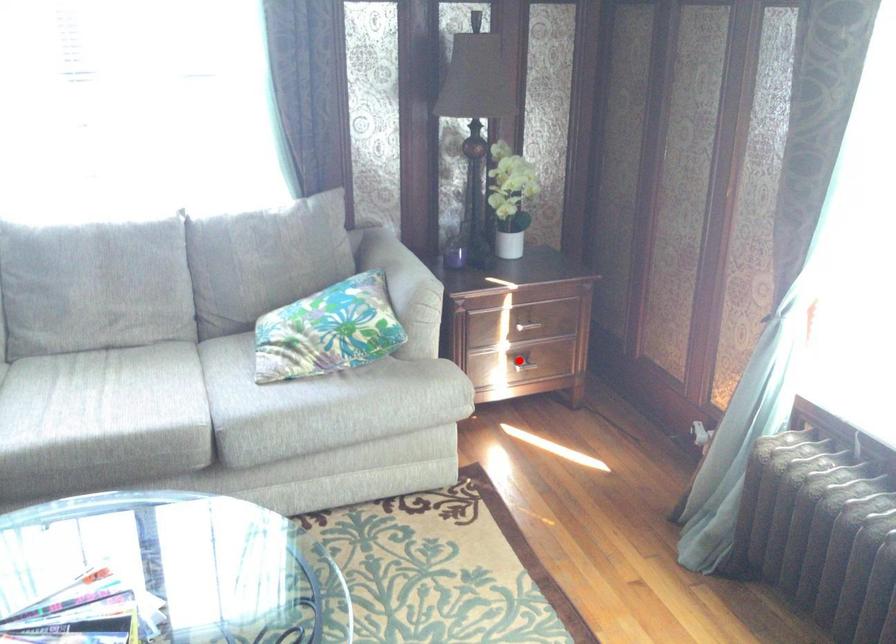
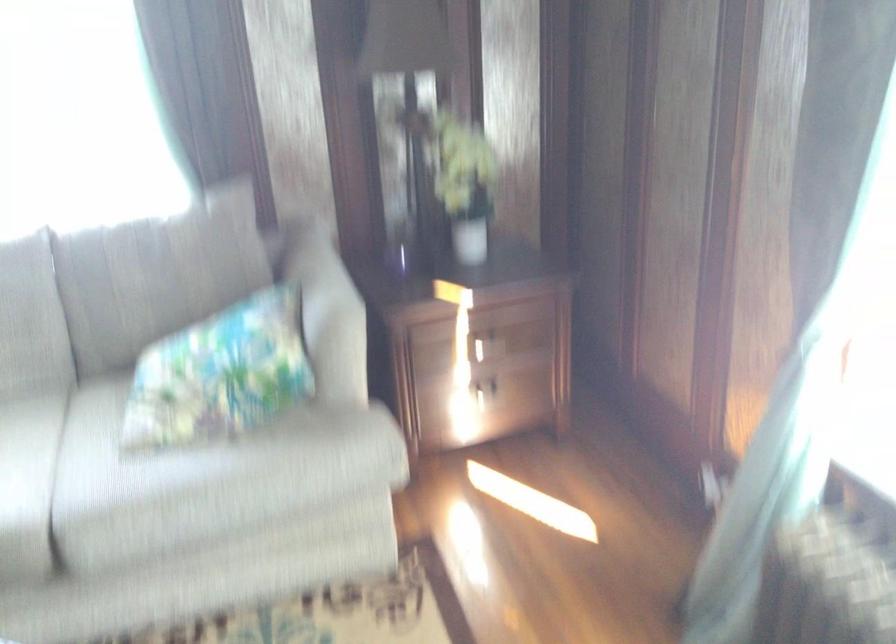
The point at the highlighted location is marked in the first image. Where is the corresponding point in the second image?

(486, 391)